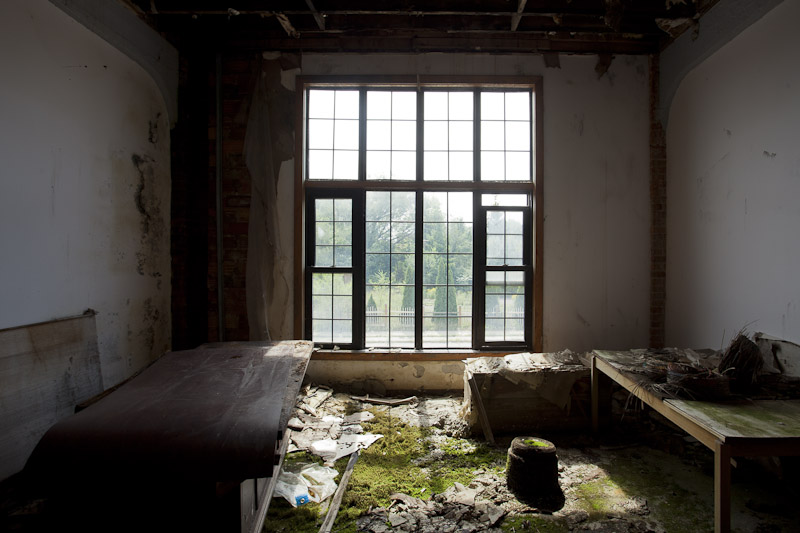
This screenshot has width=800, height=533. What are the coordinates of `left wall` in the screenshot? It's located at (41, 280).